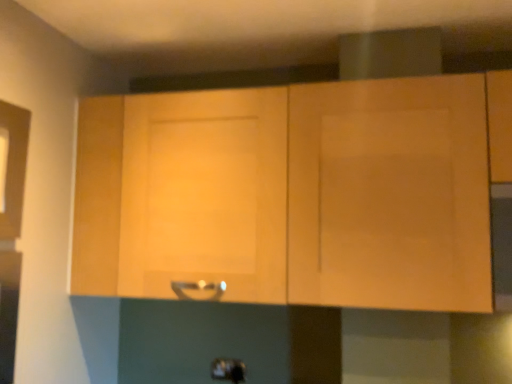
Question: From a real-world perspective, does satin silver handle at center stand above light wood cabinet at center?

Choices:
 (A) no
 (B) yes

Answer: (A)

Question: Is satin silver handle at center taller than light wood cabinet at center?

Choices:
 (A) no
 (B) yes

Answer: (A)

Question: Does satin silver handle at center have a greater width compared to light wood cabinet at center?

Choices:
 (A) no
 (B) yes

Answer: (A)

Question: Is satin silver handle at center positioned with its back to light wood cabinet at center?

Choices:
 (A) yes
 (B) no

Answer: (B)

Question: From the image's perspective, is satin silver handle at center beneath light wood cabinet at center?

Choices:
 (A) no
 (B) yes

Answer: (B)

Question: Would you say light wood cabinet at center is part of satin silver handle at center's contents?

Choices:
 (A) no
 (B) yes

Answer: (A)

Question: Is the position of light wood cabinet at center more distant than that of satin silver handle at center?

Choices:
 (A) no
 (B) yes

Answer: (A)

Question: Is satin silver handle at center located within light wood cabinet at center?

Choices:
 (A) yes
 (B) no

Answer: (B)

Question: Is light wood cabinet at center taller than satin silver handle at center?

Choices:
 (A) yes
 (B) no

Answer: (A)

Question: Does light wood cabinet at center have a smaller size compared to satin silver handle at center?

Choices:
 (A) no
 (B) yes

Answer: (A)

Question: From a real-world perspective, is light wood cabinet at center over satin silver handle at center?

Choices:
 (A) no
 (B) yes

Answer: (B)

Question: Does light wood cabinet at center appear on the right side of satin silver handle at center?

Choices:
 (A) yes
 (B) no

Answer: (A)

Question: Considering their positions, is light wood cabinet at center located in front of or behind satin silver handle at center?

Choices:
 (A) front
 (B) behind

Answer: (A)